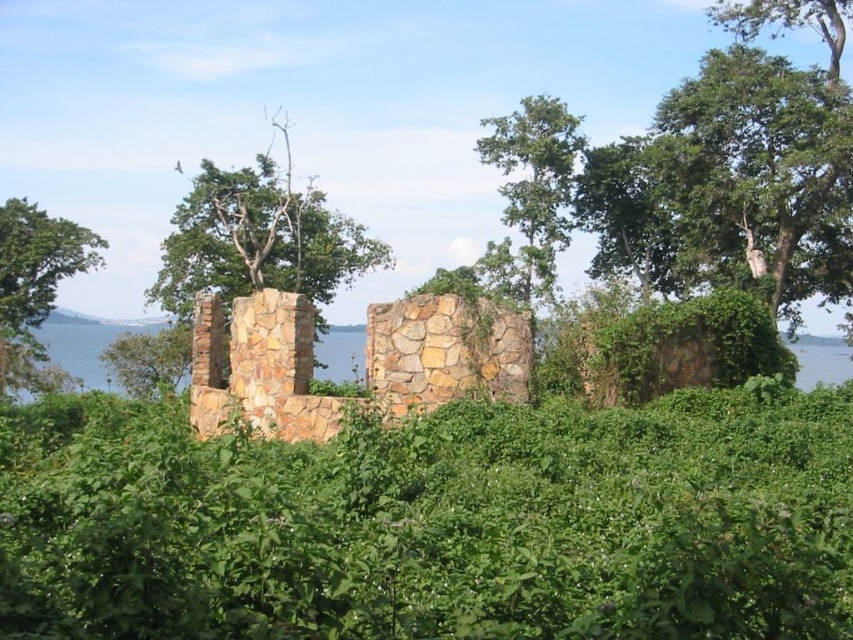
Based on the photo, which is more to the right, green leafy hedge at center or green leafy tree at upper right?

green leafy tree at upper right is more to the right.

Where is `green leafy hedge at center`? green leafy hedge at center is located at coordinates (433, 522).

Image resolution: width=853 pixels, height=640 pixels. I want to click on green leafy hedge at center, so [x=433, y=522].

Does green leafy tree at upper center lie behind green leafy tree at left?

No, green leafy tree at upper center is closer to the viewer.

Which of these two, green leafy tree at upper center or green leafy tree at left, stands shorter?

Standing shorter between the two is green leafy tree at left.

Where is `green leafy tree at upper center`? green leafy tree at upper center is located at coordinates (531, 193).

Locate an element on the screen. This screenshot has height=640, width=853. green leafy tree at upper center is located at coordinates (531, 193).

Is green leafy tree at upper right closer to camera compared to green leafy tree at left?

Yes, green leafy tree at upper right is closer to the viewer.

Is green leafy tree at upper right above green leafy tree at left?

Yes.

Which is in front, point (840, 113) or point (67, 269)?

Point (840, 113)

At what (x,y) coordinates should I click in order to perform the action: click on green leafy tree at upper right. Please return your answer as a coordinate pair (x, y). Looking at the image, I should click on (730, 182).